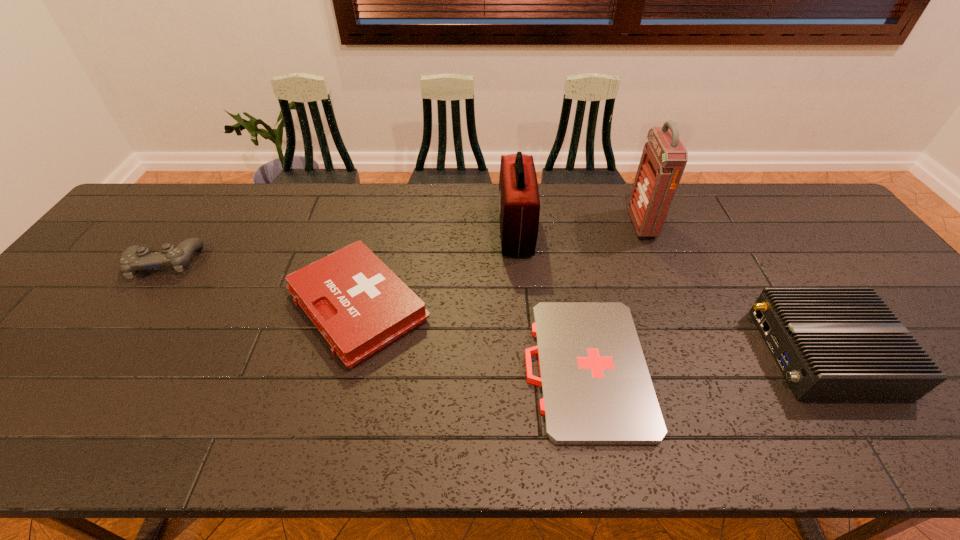
The image size is (960, 540). I want to click on vacant space located 0.320m on handle side the shortest first-aid kit, so click(x=385, y=368).

Where is `blank space located on handle side the shortest first-aid kit`? blank space located on handle side the shortest first-aid kit is located at coordinates (416, 368).

Where is `vacant position located 0.380m on handle side the shortest first-aid kit`? This screenshot has width=960, height=540. vacant position located 0.380m on handle side the shortest first-aid kit is located at coordinates (359, 368).

The image size is (960, 540). Find the location of `object that is at the near edge`. object that is at the near edge is located at coordinates (596, 389).

Locate an element on the screen. The height and width of the screenshot is (540, 960). object located at the left edge is located at coordinates (134, 258).

This screenshot has width=960, height=540. I want to click on object present at the right edge, so click(832, 344).

Identify the location of blank space at the far edge. The height and width of the screenshot is (540, 960). (606, 225).

Where is `vacant space at the near edge`? Image resolution: width=960 pixels, height=540 pixels. vacant space at the near edge is located at coordinates (324, 432).

In the image, there is a desktop. Where is `vacant space at the left edge`? The height and width of the screenshot is (540, 960). vacant space at the left edge is located at coordinates (155, 245).

In the image, there is a desktop. Identify the location of vacant space at the near left corner. (7, 444).